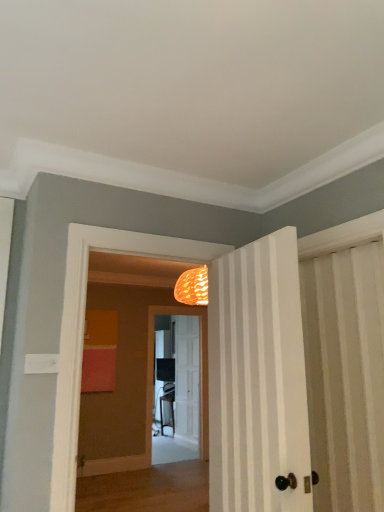
Question: Is matte black screen door at center bigger or smaller than white wooden door at center, which is the second door from right to left?

Choices:
 (A) small
 (B) big

Answer: (B)

Question: Which is correct: matte black screen door at center is inside white wooden door at center, marked as the 2th door in a top-to-bottom arrangement, or outside of it?

Choices:
 (A) outside
 (B) inside

Answer: (A)

Question: Estimate the real-world distances between objects in this image. Which object is closer to the white wooden door at center, acting as the first door starting from the back?

Choices:
 (A) matte black screen door at center
 (B) white striped door at center, which appears as the first door when viewed from the front

Answer: (A)

Question: Which of these objects is positioned closest to the white wooden door at center, the 1th door positioned from the bottom?

Choices:
 (A) white striped door at center, which is the first door in right-to-left order
 (B) matte black screen door at center

Answer: (B)